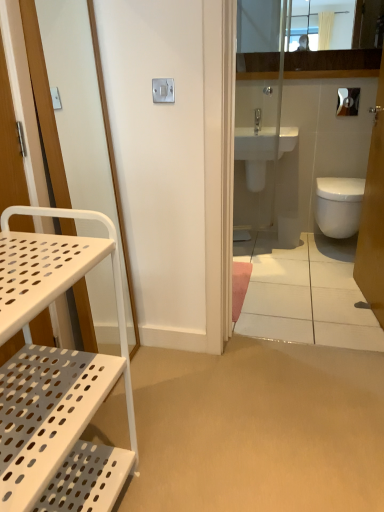
In order to click on vacant space situated on the left part of white glossy screen door at upper right, marked as the first screen door in a right-to-left arrangement in this screenshot , I will do `click(304, 305)`.